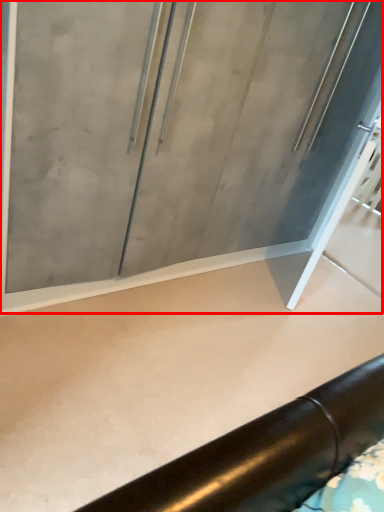
Question: Observing the image, what is the correct spatial positioning of glass door (annotated by the red box) in reference to concrete?

Choices:
 (A) right
 (B) left

Answer: (B)